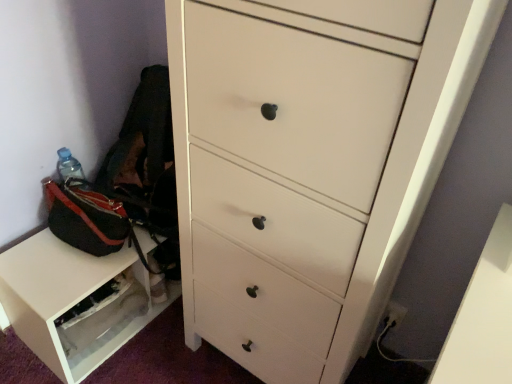
This screenshot has width=512, height=384. Describe the element at coordinates (310, 164) in the screenshot. I see `white matte chest of drawers at center` at that location.

Find the location of a particular element. This screenshot has height=384, width=512. white matte chest of drawers at center is located at coordinates (310, 164).

At what (x,y) coordinates should I click in order to perform the action: click on transparent plastic drawer at lower left. Please return your answer as a coordinate pair (x, y). Looking at the image, I should click on (73, 302).

This screenshot has height=384, width=512. Describe the element at coordinates (73, 302) in the screenshot. I see `transparent plastic drawer at lower left` at that location.

Measure the distance between point (62, 300) and camera.

Point (62, 300) and camera are 1.12 meters apart from each other.

Measure the distance between transparent plastic drawer at lower left and camera.

transparent plastic drawer at lower left is 1.09 meters away from camera.

This screenshot has width=512, height=384. I want to click on white matte chest of drawers at center, so click(x=310, y=164).

Which is more to the left, transparent plastic drawer at lower left or white matte chest of drawers at center?

transparent plastic drawer at lower left is more to the left.

In the image, is transparent plastic drawer at lower left positioned in front of or behind white matte chest of drawers at center?

Visually, transparent plastic drawer at lower left is located behind white matte chest of drawers at center.

Which is farther, [140,304] or [176,95]?

The point [140,304] is farther from the camera.

From the image's perspective, which one is positioned higher, transparent plastic drawer at lower left or white matte chest of drawers at center?

white matte chest of drawers at center.

From a real-world perspective, does transparent plastic drawer at lower left sit lower than white matte chest of drawers at center?

Yes, from a real-world perspective, transparent plastic drawer at lower left is below white matte chest of drawers at center.

Can you confirm if transparent plastic drawer at lower left is thinner than white matte chest of drawers at center?

Correct, the width of transparent plastic drawer at lower left is less than that of white matte chest of drawers at center.

Considering the sizes of transparent plastic drawer at lower left and white matte chest of drawers at center in the image, is transparent plastic drawer at lower left taller or shorter than white matte chest of drawers at center?

In the image, transparent plastic drawer at lower left appears to be shorter than white matte chest of drawers at center.

Considering the sizes of transparent plastic drawer at lower left and white matte chest of drawers at center in the image, is transparent plastic drawer at lower left bigger or smaller than white matte chest of drawers at center?

transparent plastic drawer at lower left is smaller than white matte chest of drawers at center.

Is transparent plastic drawer at lower left spatially inside white matte chest of drawers at center, or outside of it?

transparent plastic drawer at lower left is not inside white matte chest of drawers at center, it's outside.

Would you consider transparent plastic drawer at lower left to be distant from white matte chest of drawers at center?

That's not correct — transparent plastic drawer at lower left is a little close to white matte chest of drawers at center.

Is transparent plastic drawer at lower left looking in the opposite direction of white matte chest of drawers at center?

No, transparent plastic drawer at lower left's orientation is not away from white matte chest of drawers at center.

How far apart are transparent plastic drawer at lower left and white matte chest of drawers at center?

transparent plastic drawer at lower left and white matte chest of drawers at center are 19.92 inches apart from each other.

You are a GUI agent. You are given a task and a screenshot of the screen. Output one action in this format:
    pyautogui.click(x=<x>, y=<y>)
    Task: Click on the chest of drawers lying above the transparent plastic drawer at lower left (from the image's perspective)
    The width and height of the screenshot is (512, 384).
    Given the screenshot: What is the action you would take?
    pyautogui.click(x=310, y=164)

Is white matte chest of drawers at center to the left or to the right of transparent plastic drawer at lower left in the image?

white matte chest of drawers at center is positioned on transparent plastic drawer at lower left's right side.

Which object is further away from the camera, white matte chest of drawers at center or transparent plastic drawer at lower left?

transparent plastic drawer at lower left is more distant.

Between point (402, 185) and point (40, 341), which one is positioned behind?

Positioned behind is point (40, 341).

From the image's perspective, is white matte chest of drawers at center above or below transparent plastic drawer at lower left?

Clearly, from the image's perspective, white matte chest of drawers at center is above transparent plastic drawer at lower left.

From a real-world perspective, is white matte chest of drawers at center below transparent plastic drawer at lower left?

No, from a real-world perspective, white matte chest of drawers at center is not under transparent plastic drawer at lower left.

Considering the sizes of objects white matte chest of drawers at center and transparent plastic drawer at lower left in the image provided, who is wider, white matte chest of drawers at center or transparent plastic drawer at lower left?

Wider between the two is white matte chest of drawers at center.

Does white matte chest of drawers at center have a lesser height compared to transparent plastic drawer at lower left?

No, white matte chest of drawers at center is not shorter than transparent plastic drawer at lower left.

Based on their sizes in the image, would you say white matte chest of drawers at center is bigger or smaller than transparent plastic drawer at lower left?

In the image, white matte chest of drawers at center appears to be larger than transparent plastic drawer at lower left.

Is white matte chest of drawers at center inside the boundaries of transparent plastic drawer at lower left, or outside?

white matte chest of drawers at center cannot be found inside transparent plastic drawer at lower left.

Are white matte chest of drawers at center and transparent plastic drawer at lower left making contact?

No, white matte chest of drawers at center is not next to transparent plastic drawer at lower left.

Is white matte chest of drawers at center oriented away from transparent plastic drawer at lower left?

No, white matte chest of drawers at center is not facing the opposite direction of transparent plastic drawer at lower left.

I want to click on cabinetry below the white matte chest of drawers at center (from the image's perspective), so click(73, 302).

The image size is (512, 384). What are the coordinates of `cabinetry located on the left of white matte chest of drawers at center` in the screenshot? It's located at (73, 302).

In the image, there is a transparent plastic drawer at lower left. What are the coordinates of `the chest of drawers above it (from the image's perspective)` in the screenshot? It's located at (310, 164).